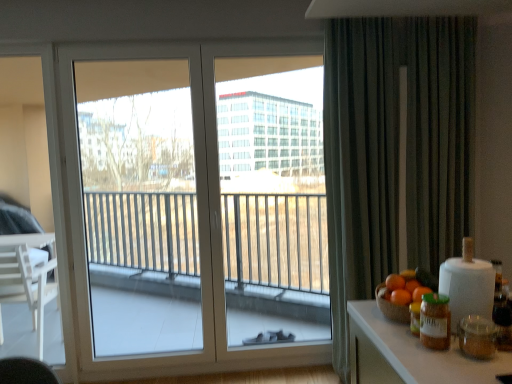
Where is `empty space that is ontop of transparent glass window at left (from a real-world perspective)`? This screenshot has width=512, height=384. empty space that is ontop of transparent glass window at left (from a real-world perspective) is located at coordinates (144, 47).